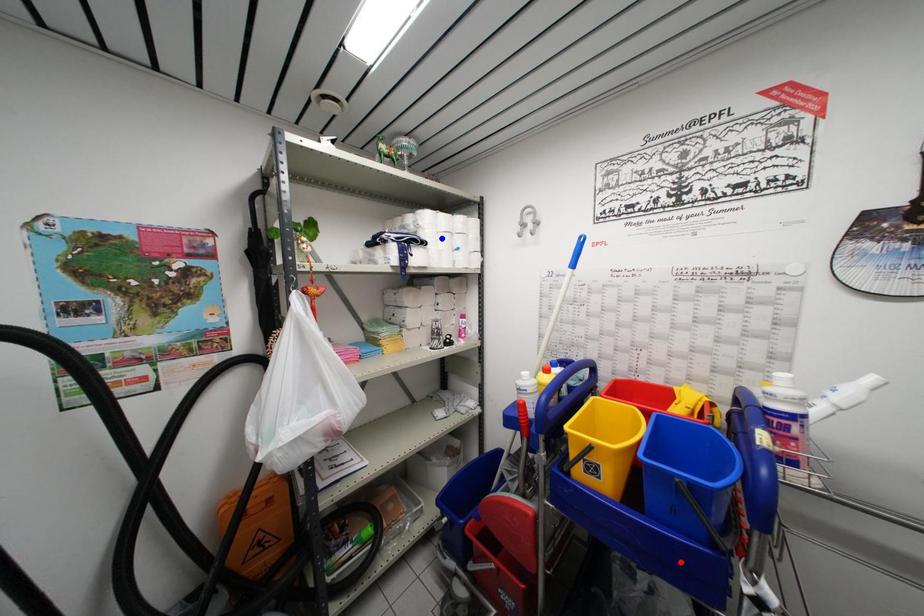
Question: In the image, two points are highlighted. Which point is nearer to the camera? Reply with the corresponding letter.

Choices:
 (A) blue point
 (B) red point

Answer: (B)